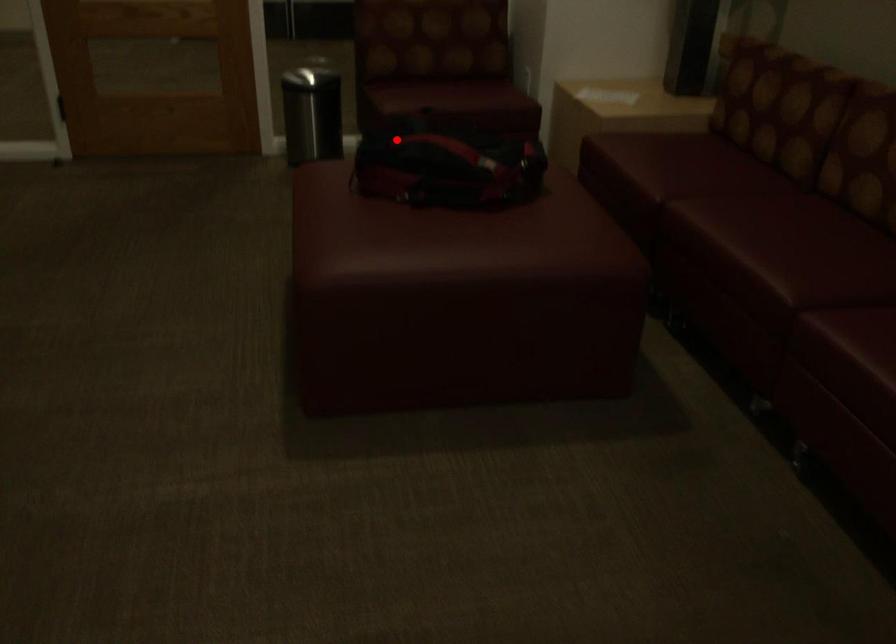
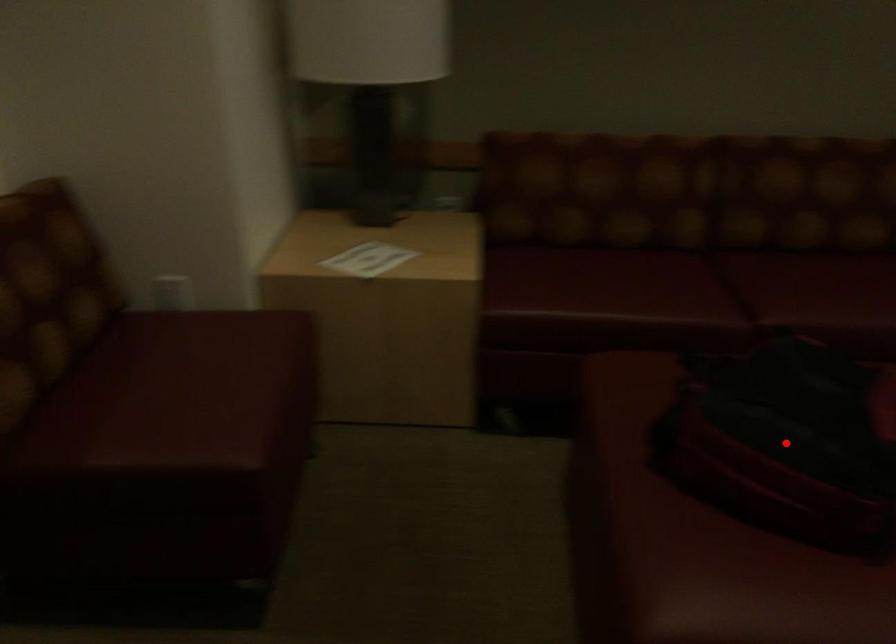
I am providing you with two images of the same scene from different viewpoints. A red point is marked on the first image and another point is marked on the second image. Do the highlighted points in image1 and image2 indicate the same real-world spot?

Yes